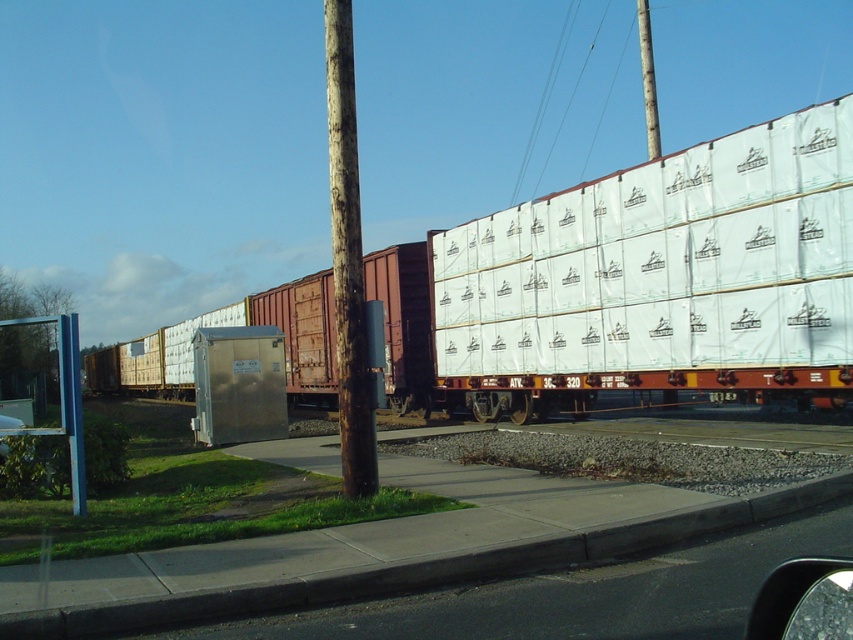
This screenshot has height=640, width=853. I want to click on white plastic containers at center, so click(650, 282).

Who is more distant from viewer, (608,353) or (335,26)?

Point (608,353)

Between point (750, 147) and point (349, 397), which one is positioned behind?

Positioned behind is point (750, 147).

Locate an element on the screen. The image size is (853, 640). white plastic containers at center is located at coordinates (650, 282).

Does rusty wood pole at center have a larger size compared to brown wooden pole at upper center?

No, rusty wood pole at center is not bigger than brown wooden pole at upper center.

Which is below, rusty wood pole at center or brown wooden pole at upper center?

rusty wood pole at center is below.

Where is `rusty wood pole at center`? This screenshot has width=853, height=640. rusty wood pole at center is located at coordinates (347, 259).

Is point (749, 337) closer to camera compared to point (648, 99)?

Yes, it is.

Does white plastic containers at center have a lesser width compared to brown wooden pole at upper center?

Incorrect, white plastic containers at center's width is not less than brown wooden pole at upper center's.

Describe the element at coordinates (650, 282) in the screenshot. This screenshot has height=640, width=853. I see `white plastic containers at center` at that location.

Find the location of a particular element. white plastic containers at center is located at coordinates (650, 282).